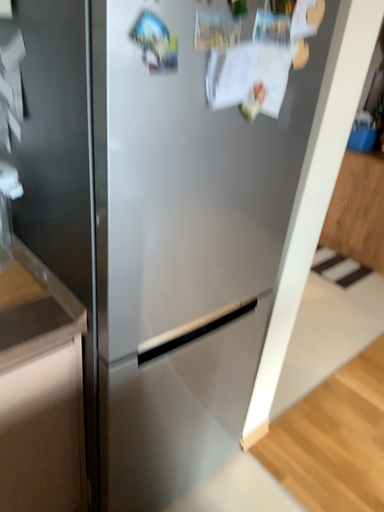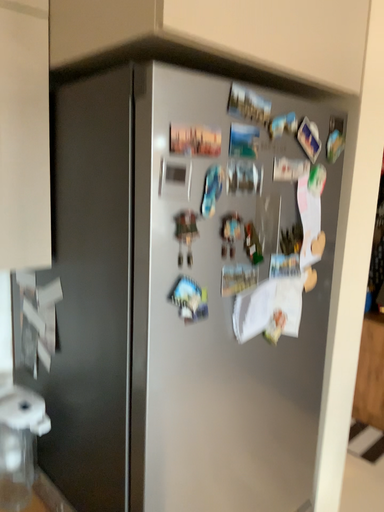
Question: How did the camera likely rotate when shooting the video?

Choices:
 (A) rotated upward
 (B) rotated downward

Answer: (A)